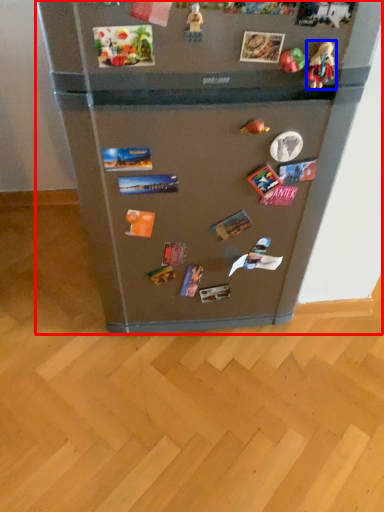
Question: Which object appears closest to the camera in this image, refrigerator (highlighted by a red box) or toy (highlighted by a blue box)?

Choices:
 (A) refrigerator
 (B) toy

Answer: (A)